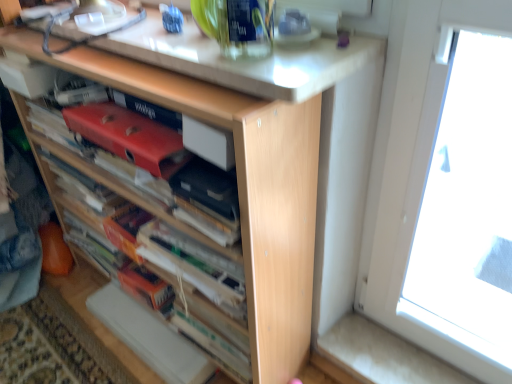
Question: Is wooden book at center positioned beyond the bounds of matte red paperback book at center, the 2th paperback book positioned from the right?

Choices:
 (A) no
 (B) yes

Answer: (B)

Question: Considering the relative positions of wooden book at center and matte red paperback book at center, positioned as the 1th paperback book in left-to-right order, in the image provided, is wooden book at center to the left of matte red paperback book at center, positioned as the 1th paperback book in left-to-right order, from the viewer's perspective?

Choices:
 (A) yes
 (B) no

Answer: (A)

Question: From a real-world perspective, is wooden book at center on top of matte red paperback book at center, positioned as the 1th paperback book in left-to-right order?

Choices:
 (A) no
 (B) yes

Answer: (A)

Question: From a real-world perspective, is wooden book at center located beneath matte red paperback book at center, positioned as the 1th paperback book in left-to-right order?

Choices:
 (A) no
 (B) yes

Answer: (B)

Question: Considering the relative sizes of wooden book at center and matte red paperback book at center, positioned as the 1th paperback book in left-to-right order, in the image provided, is wooden book at center taller than matte red paperback book at center, positioned as the 1th paperback book in left-to-right order,?

Choices:
 (A) no
 (B) yes

Answer: (B)

Question: Is matte red paperback book at center, the 2th paperback book positioned from the right, inside wooden book at center?

Choices:
 (A) yes
 (B) no

Answer: (A)

Question: Does matte black paperback book at center, the 2th paperback book from the left, have a greater height compared to wooden book at center?

Choices:
 (A) no
 (B) yes

Answer: (A)

Question: From a real-world perspective, is matte black paperback book at center, positioned as the 1th paperback book in right-to-left order, over wooden book at center?

Choices:
 (A) yes
 (B) no

Answer: (A)

Question: From a real-world perspective, is matte black paperback book at center, positioned as the 1th paperback book in right-to-left order, positioned under wooden book at center based on gravity?

Choices:
 (A) yes
 (B) no

Answer: (B)

Question: Can you confirm if matte black paperback book at center, the 2th paperback book from the left, is smaller than wooden book at center?

Choices:
 (A) no
 (B) yes

Answer: (B)

Question: Considering the relative sizes of matte black paperback book at center, the 2th paperback book from the left, and wooden book at center in the image provided, is matte black paperback book at center, the 2th paperback book from the left, thinner than wooden book at center?

Choices:
 (A) yes
 (B) no

Answer: (A)

Question: Are matte black paperback book at center, the 2th paperback book from the left, and wooden book at center beside each other?

Choices:
 (A) yes
 (B) no

Answer: (B)

Question: Considering the relative positions of matte red paperback book at center, the 2th paperback book positioned from the right, and white glossy countertop at upper center in the image provided, is matte red paperback book at center, the 2th paperback book positioned from the right, in front of white glossy countertop at upper center?

Choices:
 (A) yes
 (B) no

Answer: (B)